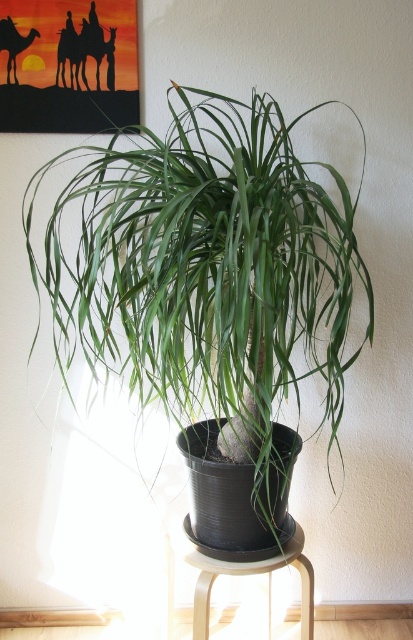
Question: Does wooden stool at lower center appear over brown textured camel at upper left?

Choices:
 (A) yes
 (B) no

Answer: (B)

Question: Considering the relative positions of brown textured camel at upper left and matte black camel at upper left in the image provided, where is brown textured camel at upper left located with respect to matte black camel at upper left?

Choices:
 (A) above
 (B) below

Answer: (A)

Question: Which point is closer to the camera?

Choices:
 (A) (173, 616)
 (B) (235, 328)
 (C) (14, 76)

Answer: (B)

Question: Based on their relative distances, which object is nearer to the green matte plant at center?

Choices:
 (A) matte black camel at upper left
 (B) wooden stool at lower center
 (C) brown textured camel at upper left

Answer: (B)

Question: Considering the real-world distances, which object is farthest from the wooden stool at lower center?

Choices:
 (A) green matte plant at center
 (B) brown textured camel at upper left

Answer: (B)

Question: From the image, what is the correct spatial relationship of green matte plant at center in relation to brown textured camel at upper left?

Choices:
 (A) above
 (B) below

Answer: (B)